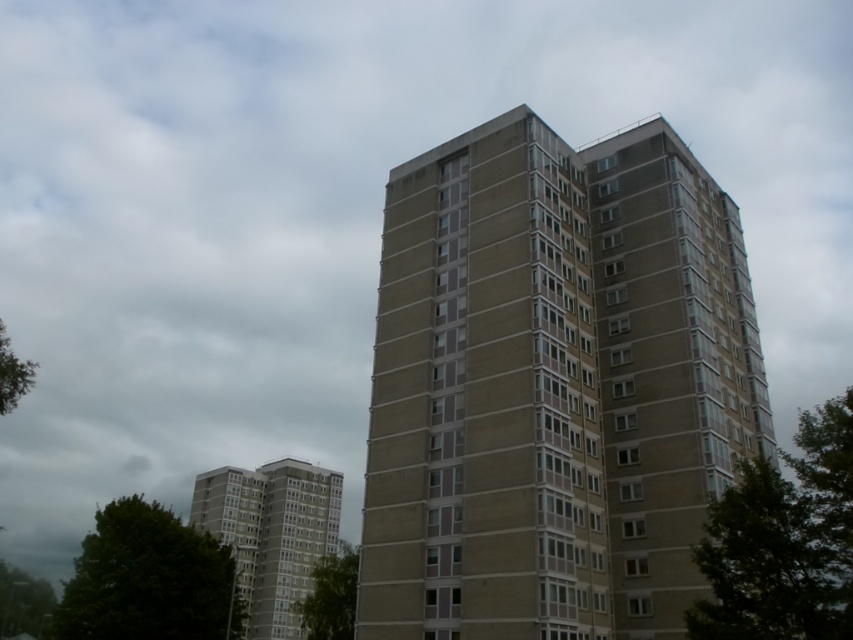
Question: Which object appears farthest from the camera in this image?

Choices:
 (A) concrete building at lower left
 (B) green leafy tree at right
 (C) green leafy tree at lower left
 (D) concrete tower block at center

Answer: (A)

Question: Which point is farther from the camera taking this photo?

Choices:
 (A) (347, 552)
 (B) (291, 513)
 (C) (183, 602)
 (D) (791, 596)

Answer: (B)

Question: Is green leafy tree at right in front of concrete building at lower left?

Choices:
 (A) yes
 (B) no

Answer: (A)

Question: Is green leafy tree at right smaller than green leafy tree at lower center?

Choices:
 (A) yes
 (B) no

Answer: (B)

Question: Among these objects, which one is nearest to the camera?

Choices:
 (A) green leafy tree at lower center
 (B) concrete tower block at center

Answer: (B)

Question: Can you confirm if green leafy tree at right is positioned above green leafy tree at lower center?

Choices:
 (A) no
 (B) yes

Answer: (B)